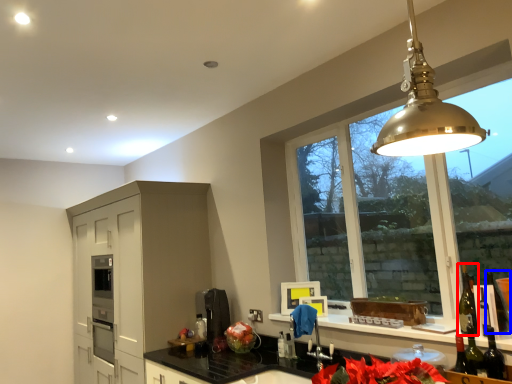
Question: Among these objects, which one is nearest to the camera, wine bottle (highlighted by a red box) or wine bottle (highlighted by a blue box)?

Choices:
 (A) wine bottle
 (B) wine bottle

Answer: (B)